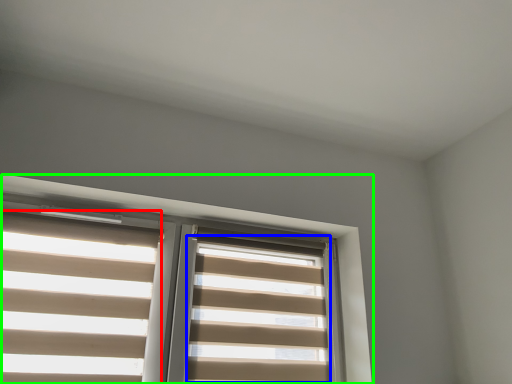
Question: Based on their relative distances, which object is nearer to blind (highlighted by a red box)? Choose from blind (highlighted by a blue box) and window (highlighted by a green box).

Choices:
 (A) blind
 (B) window

Answer: (B)